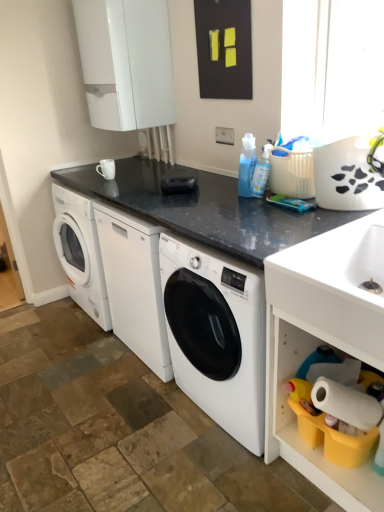
Question: From the image's perspective, is white plastic shelf at lower right above or below blue glossy bottle at center?

Choices:
 (A) below
 (B) above

Answer: (A)

Question: In terms of width, does white plastic shelf at lower right look wider or thinner when compared to blue glossy bottle at center?

Choices:
 (A) thin
 (B) wide

Answer: (B)

Question: Considering the real-world distances, which object is closest to the white glossy sink at lower right?

Choices:
 (A) black granite countertop at center
 (B) blue glossy bottle at center
 (C) white plastic shelf at lower right

Answer: (C)

Question: Based on their relative distances, which object is nearer to the white glossy sink at lower right?

Choices:
 (A) black granite countertop at center
 (B) blue glossy bottle at center
 (C) white plastic shelf at lower right

Answer: (C)